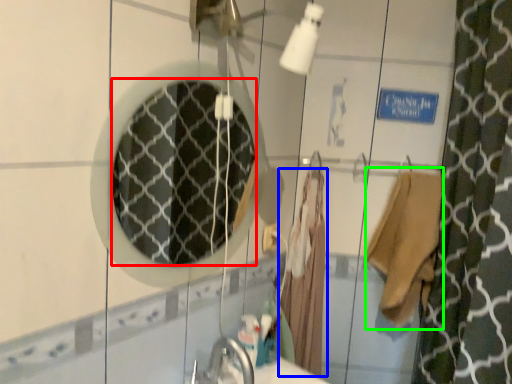
Question: Which is farther away from mirror (highlighted by a red box)? bathrobe (highlighted by a blue box) or robe (highlighted by a green box)?

Choices:
 (A) bathrobe
 (B) robe

Answer: (B)